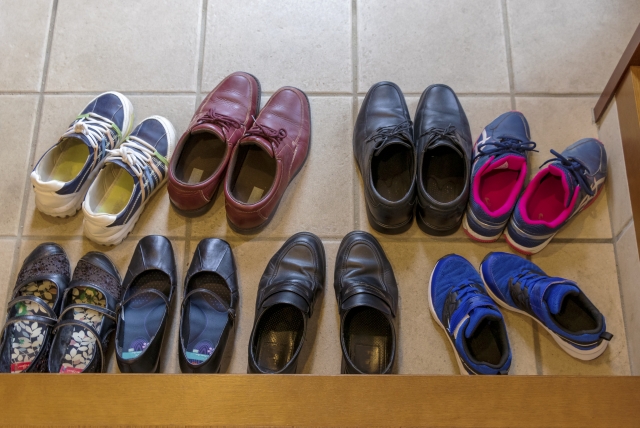
Find the location of a particular element. Image resolution: width=640 pixels, height=428 pixels. pairs of shoes is located at coordinates (84, 183), (225, 163), (413, 175), (518, 197), (493, 297), (326, 296), (179, 300), (58, 313).